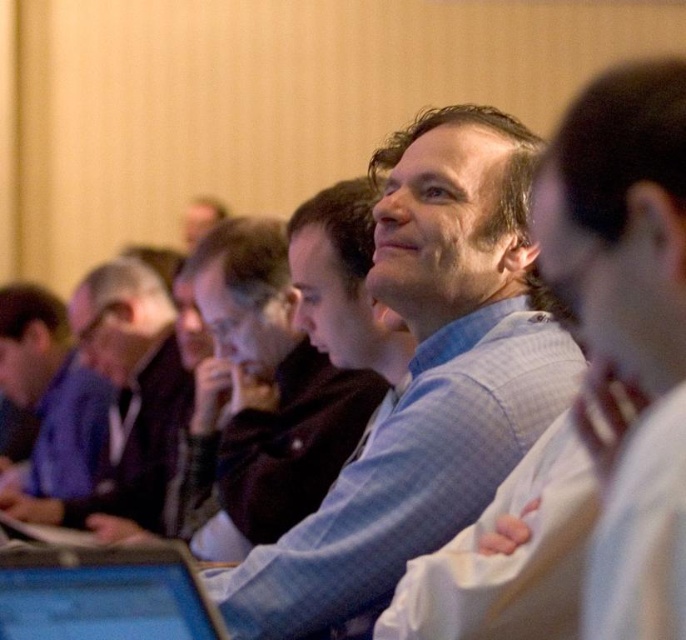
Is blue checkered shirt at center thinner than blue fabric jacket at left?

Correct, blue checkered shirt at center's width is less than blue fabric jacket at left's.

Does point (466, 397) come farther from viewer compared to point (102, 493)?

No, it is not.

Is point (519, 451) in front of point (27, 513)?

Yes, it is.

Locate an element on the screen. The image size is (686, 640). blue checkered shirt at center is located at coordinates (425, 380).

I want to click on blue glossy laptop at center, so click(x=102, y=595).

Is blue checkered shirt at center to the left of matte blue shirt at left from the viewer's perspective?

No, blue checkered shirt at center is not to the left of matte blue shirt at left.

Does point (525, 406) come in front of point (75, 424)?

Yes, point (525, 406) is in front of point (75, 424).

Locate an element on the screen. The width and height of the screenshot is (686, 640). blue checkered shirt at center is located at coordinates (425, 380).